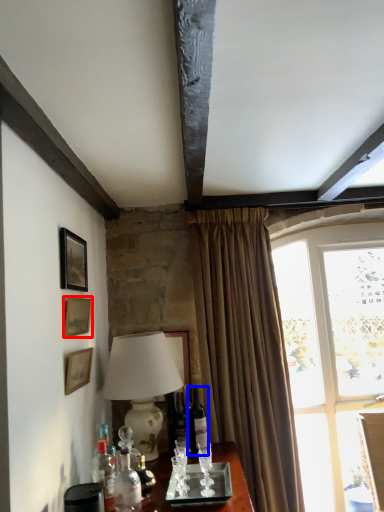
Question: Which object is closer to the camera taking this photo, picture frame (highlighted by a red box) or wine bottle (highlighted by a blue box)?

Choices:
 (A) picture frame
 (B) wine bottle

Answer: (A)